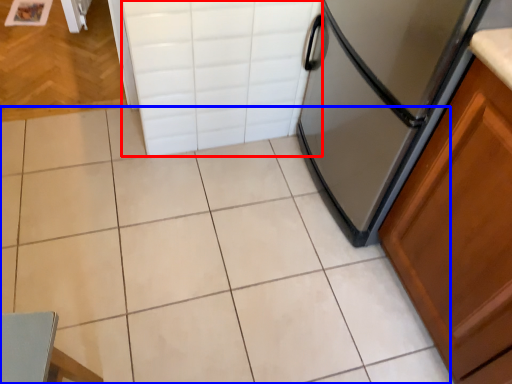
Question: Among these objects, which one is farthest to the camera, drawer (highlighted by a red box) or ceramic tile (highlighted by a blue box)?

Choices:
 (A) drawer
 (B) ceramic tile

Answer: (A)